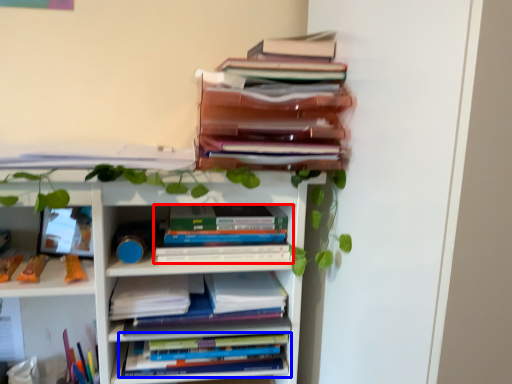
Question: Among these objects, which one is farthest to the camera, book (highlighted by a red box) or book (highlighted by a blue box)?

Choices:
 (A) book
 (B) book

Answer: (B)